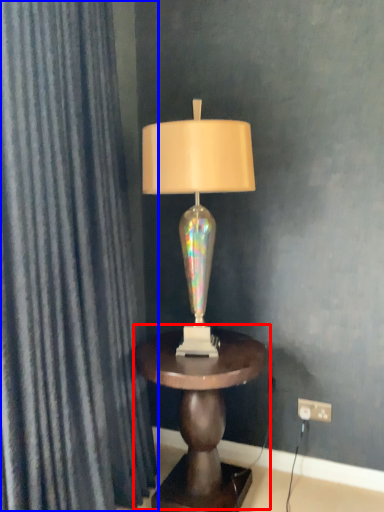
Question: Which point is closer to the camera, table (highlighted by a red box) or curtain (highlighted by a blue box)?

Choices:
 (A) table
 (B) curtain

Answer: (B)